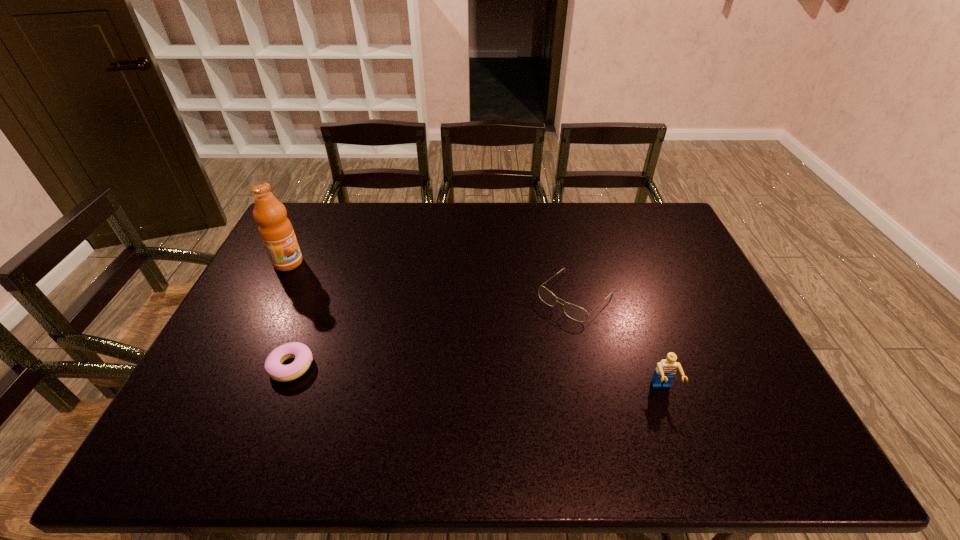
Identify the location of free space located on the front-facing side of the third tallest object. This screenshot has width=960, height=540. (494, 374).

Identify the location of vacant area situated on the front-facing side of the third tallest object. (502, 366).

This screenshot has height=540, width=960. I want to click on vacant space located on the label side of the leftmost object, so click(x=332, y=288).

Locate an element on the screen. Image resolution: width=960 pixels, height=540 pixels. vacant area situated on the label side of the leftmost object is located at coordinates (350, 298).

The image size is (960, 540). I want to click on vacant region located 0.380m on the label side of the leftmost object, so click(385, 318).

This screenshot has height=540, width=960. In order to click on doughnut at the near edge in this screenshot , I will do `click(273, 365)`.

I want to click on Lego present at the near edge, so click(665, 371).

The height and width of the screenshot is (540, 960). Find the location of `doughnut positioned at the left edge`. doughnut positioned at the left edge is located at coordinates (273, 365).

Identify the location of fruit juice at the left edge. (276, 231).

The image size is (960, 540). In order to click on object that is at the near left corner in this screenshot , I will do `click(273, 365)`.